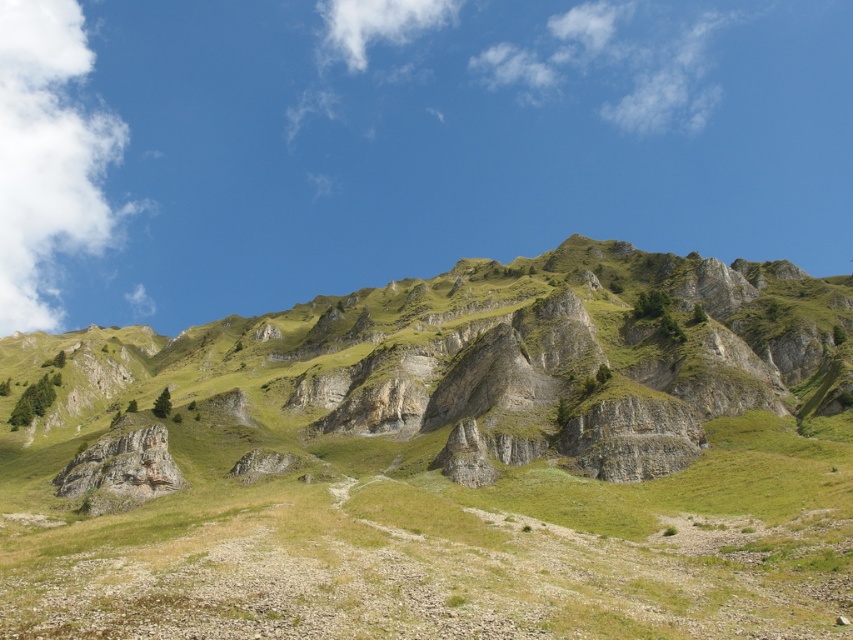
You are a hiker planning to ascend the mountain. You see a point marked at coordinates (x=445, y=460). Based on the scene description, what type of terrain would you expect to encounter at that location?

The point at coordinates (x=445, y=460) indicates green grassy mountain at upper center, so you can expect to encounter green grassy terrain there.

Consider the image. You are planning a hiking route and see the green grassy mountain at upper center and the white fluffy cloud at upper left. Which object is located lower in the image?

The green grassy mountain at upper center is positioned under the white fluffy cloud at upper left, so it is located lower in the image.